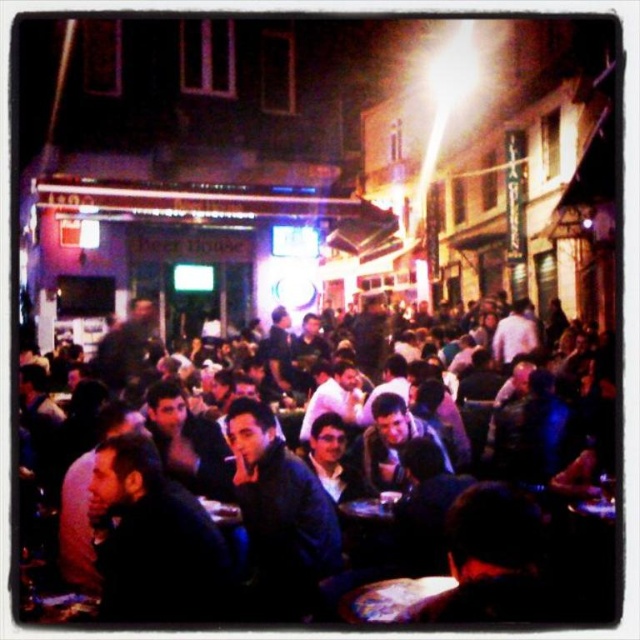
You are a photographer trying to capture a clear shot of the dark blue clothing at center and the shiny metallic table at center. Since you want both subjects to be in focus, you need to adjust your camera settings. Considering their sizes, which object should you focus on first to ensure both are sharp?

The dark blue clothing at center is bigger than the shiny metallic table at center, so you should focus on the larger object first to ensure both are in focus.